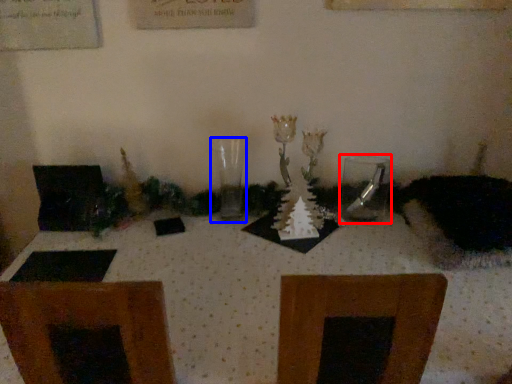
Question: Among these objects, which one is farthest to the camera, tableware (highlighted by a red box) or candle holder (highlighted by a blue box)?

Choices:
 (A) tableware
 (B) candle holder

Answer: (A)